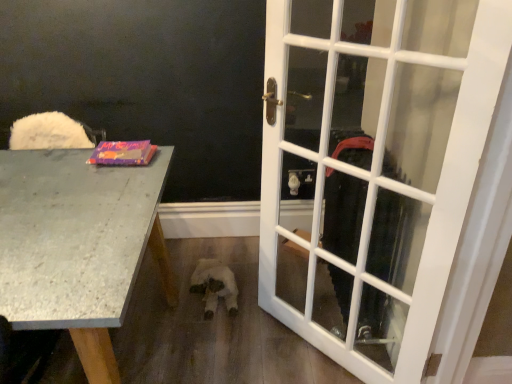
Where is `empty space that is in between white glass door at right and white plush toy at center`? empty space that is in between white glass door at right and white plush toy at center is located at coordinates (253, 312).